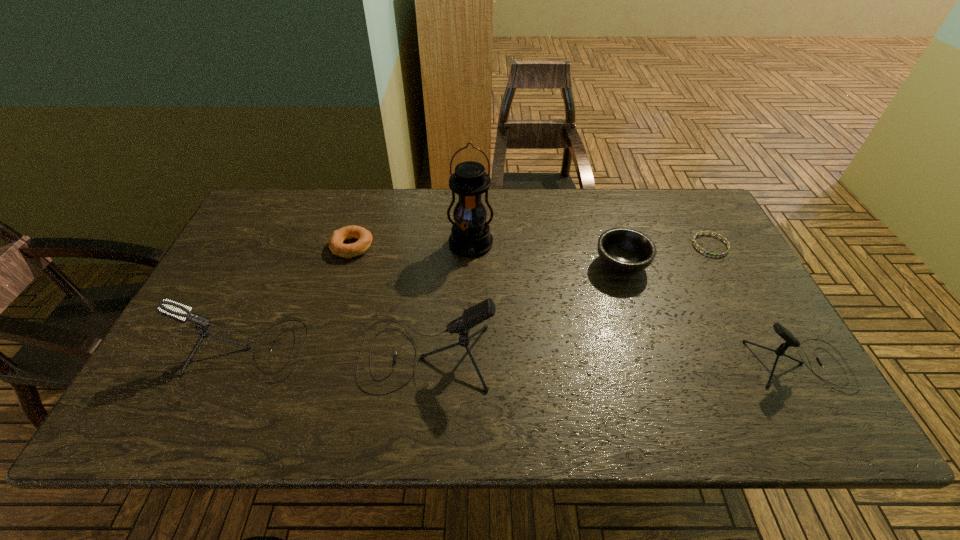
This screenshot has width=960, height=540. In order to click on empty space between the shortest object and the rightmost microphone in this screenshot , I will do `click(755, 306)`.

Locate an element on the screen. The image size is (960, 540). free spot between the shortest object and the rightmost microphone is located at coordinates (755, 306).

Find the location of a particular element. vacant area that lies between the tallest object and the leftmost microphone is located at coordinates (358, 297).

Locate which object ranks third in proximity to the second microphone from left to right. Please provide its 2D coordinates. Your answer should be formatted as a tuple, i.e. [(x, y)], where the tuple contains the x and y coordinates of a point satisfying the conditions above.

[(364, 237)]

Select which object is the third closest to the bracelet. Please provide its 2D coordinates. Your answer should be formatted as a tuple, i.e. [(x, y)], where the tuple contains the x and y coordinates of a point satisfying the conditions above.

[(470, 236)]

Where is `microphone that is the second closest to the bracelet`? microphone that is the second closest to the bracelet is located at coordinates (480, 312).

The height and width of the screenshot is (540, 960). I want to click on microphone that is the closest to the second microphone from left to right, so click(x=172, y=309).

Identify the location of vacant area that satisfies the following two spatial constraints: 1. on the front side of the third object from right to left; 2. on the stand of the second microphone from right to left. (650, 355).

Locate an element on the screen. The height and width of the screenshot is (540, 960). vacant position in the image that satisfies the following two spatial constraints: 1. above the tallest object, indicating its light source; 2. on the right side of the third object from right to left is located at coordinates (470, 265).

You are a GUI agent. You are given a task and a screenshot of the screen. Output one action in this format:
    pyautogui.click(x=<x>, y=<y>)
    Task: Click on the free spot that satisfies the following two spatial constraints: 1. on the front side of the bowl; 2. on the stand of the second microphone from right to left
    This screenshot has height=540, width=960.
    Given the screenshot: What is the action you would take?
    pyautogui.click(x=650, y=355)